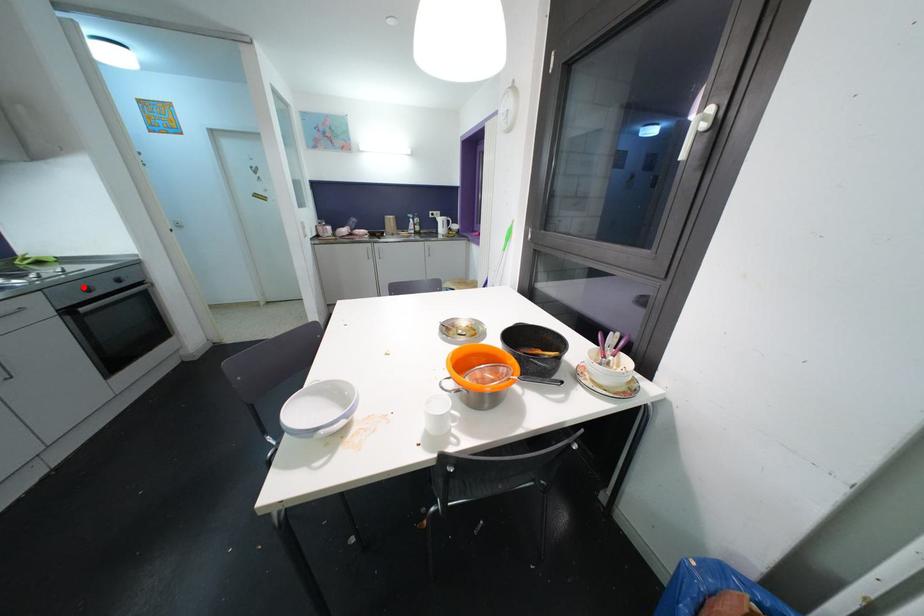
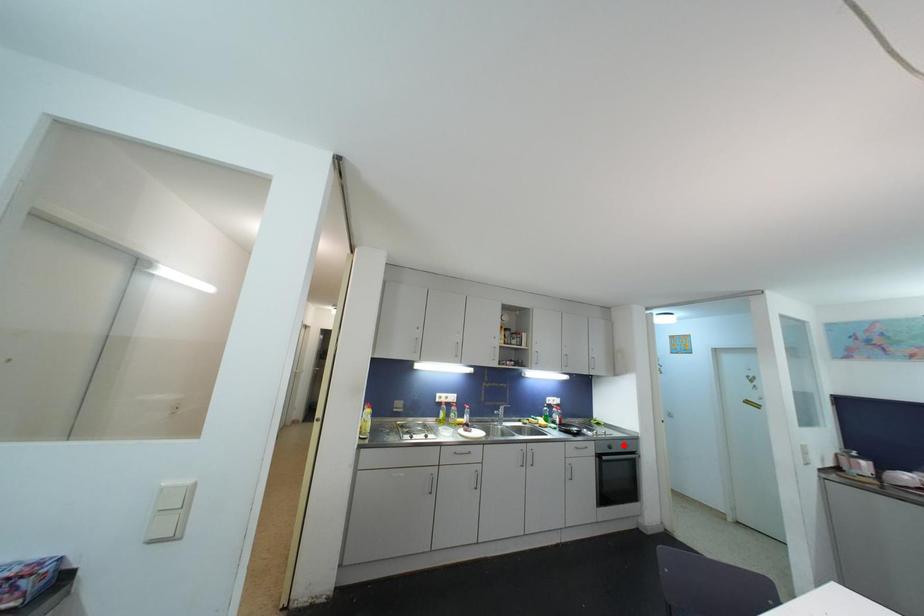
I am providing you with two images of the same scene from different viewpoints. A red point is marked on the first image and another point is marked on the second image. Do the highlighted points in image1 and image2 indicate the same real-world spot?

No